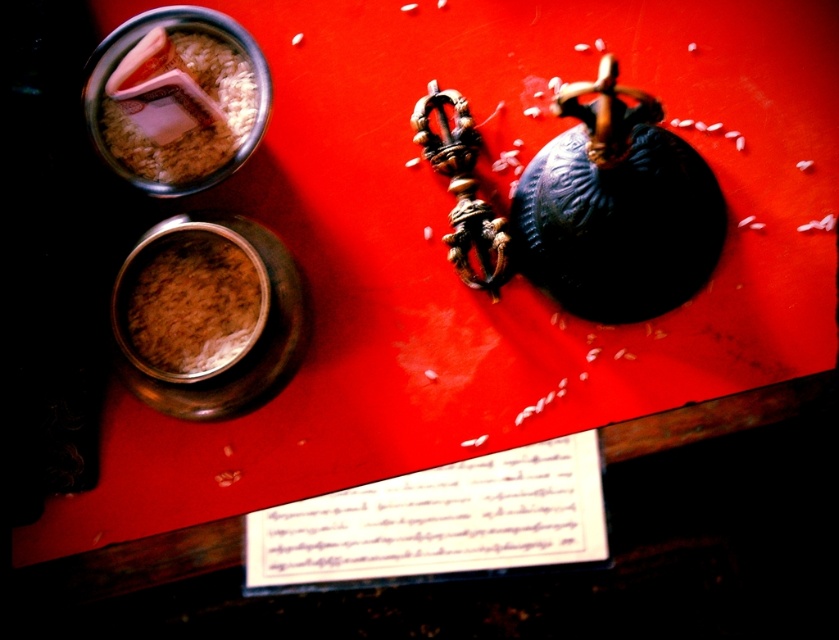
Which is more to the right, white matte rice at upper left or brown matte powder at center?

brown matte powder at center is more to the right.

Locate an element on the screen. Image resolution: width=839 pixels, height=640 pixels. white matte rice at upper left is located at coordinates (176, 106).

Which is behind, point (133, 138) or point (117, 333)?

Point (133, 138)

At what (x,y) coordinates should I click in order to perform the action: click on white matte rice at upper left. Please return your answer as a coordinate pair (x, y). This screenshot has width=839, height=640. Looking at the image, I should click on (176, 106).